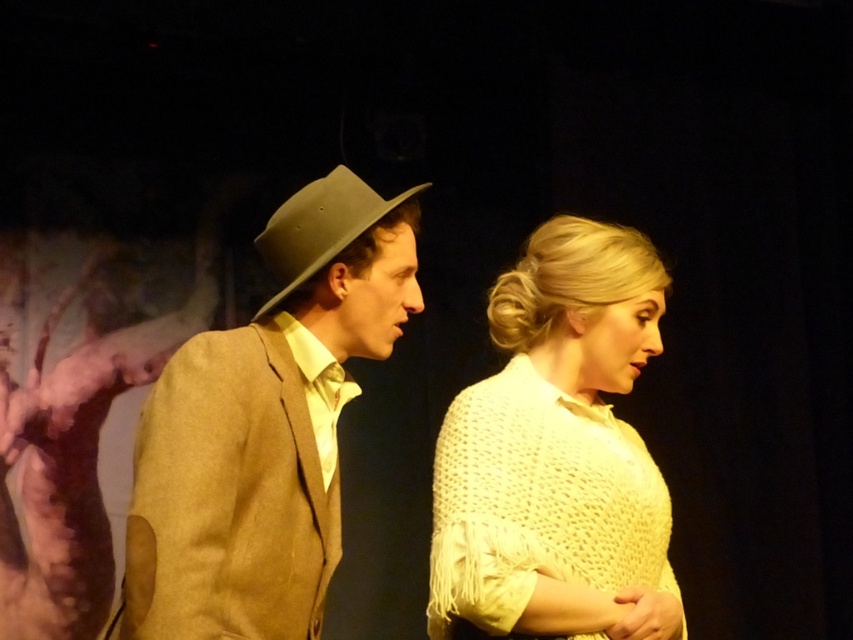
Question: Can you confirm if matte brown suit at left is smaller than matte brown hat at center?

Choices:
 (A) no
 (B) yes

Answer: (A)

Question: Which of the following is the closest to the observer?

Choices:
 (A) matte brown suit at left
 (B) matte brown hat at center

Answer: (A)

Question: Based on their relative distances, which object is nearer to the matte brown suit at left?

Choices:
 (A) white knitted shawl at center
 (B) matte brown hat at center

Answer: (B)

Question: Is matte brown suit at left bigger than white knitted shawl at center?

Choices:
 (A) no
 (B) yes

Answer: (A)

Question: Which point is farther to the camera?

Choices:
 (A) white knitted shawl at center
 (B) matte brown suit at left
 (C) matte brown hat at center

Answer: (A)

Question: Is matte brown suit at left closer to the viewer compared to matte brown hat at center?

Choices:
 (A) no
 (B) yes

Answer: (B)